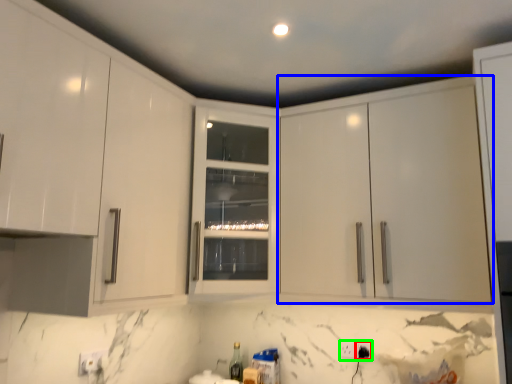
Question: Estimate the real-world distances between objects in this image. Which object is closer to electric outlet (highlighted by a red box), cabinetry (highlighted by a blue box) or electric outlet (highlighted by a green box)?

Choices:
 (A) cabinetry
 (B) electric outlet

Answer: (B)